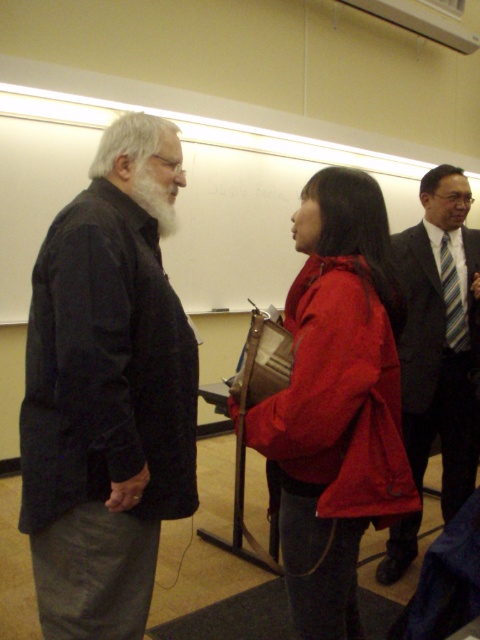
Question: Which object is the closest to the dark gray fabric jacket at left?

Choices:
 (A) matte red jacket at center
 (B) dark gray suit at right
 (C) whitehairbeard at left

Answer: (C)

Question: Does dark gray fabric jacket at left have a lesser width compared to matte red jacket at center?

Choices:
 (A) no
 (B) yes

Answer: (B)

Question: Which of these objects is positioned farthest from the dark gray suit at right?

Choices:
 (A) dark gray fabric jacket at left
 (B) matte red jacket at center

Answer: (A)

Question: Is matte red jacket at center smaller than whitehairbeard at left?

Choices:
 (A) no
 (B) yes

Answer: (A)

Question: Can you confirm if matte red jacket at center is positioned below whitehairbeard at left?

Choices:
 (A) yes
 (B) no

Answer: (A)

Question: Which object is closer to the camera taking this photo?

Choices:
 (A) whitehairbeard at left
 (B) dark gray suit at right
 (C) matte red jacket at center
 (D) dark gray fabric jacket at left

Answer: (D)